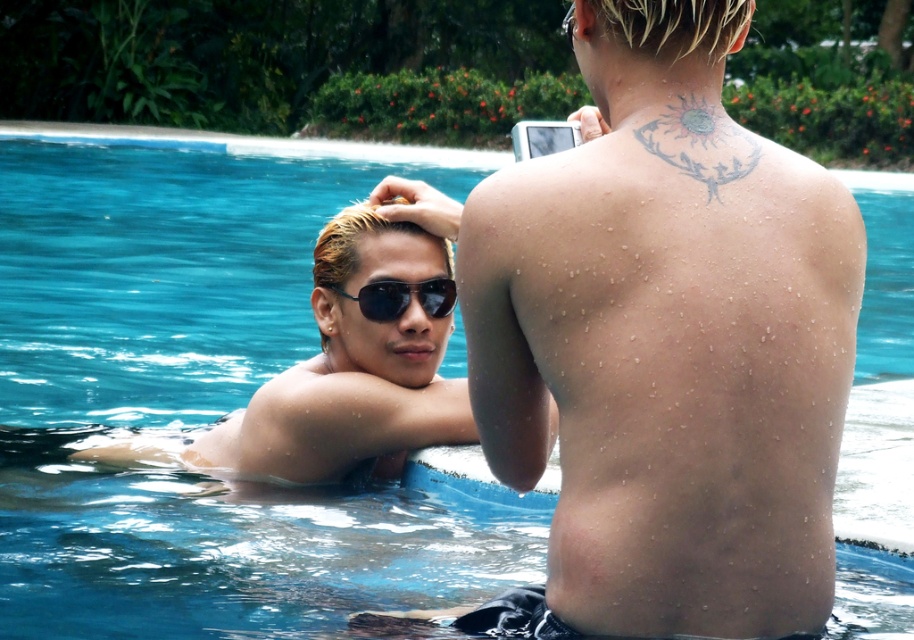
You are standing at the edge of the pool and want to determine which of the two points, point (558, 260) or point (433, 429), is closer to you. Based on the scene, which point is nearer?

Point (558, 260) is closer to the viewer than point (433, 429).

From the picture: You are designing a tattoo catalog and need to know the relative sizes of the tattoos. Which tattoo is narrower, the gray ink sun at upper back or the black reflective sunglasses at upper center?

The gray ink sun at upper back is thinner than the black reflective sunglasses at upper center, so the gray ink sun at upper back is narrower.